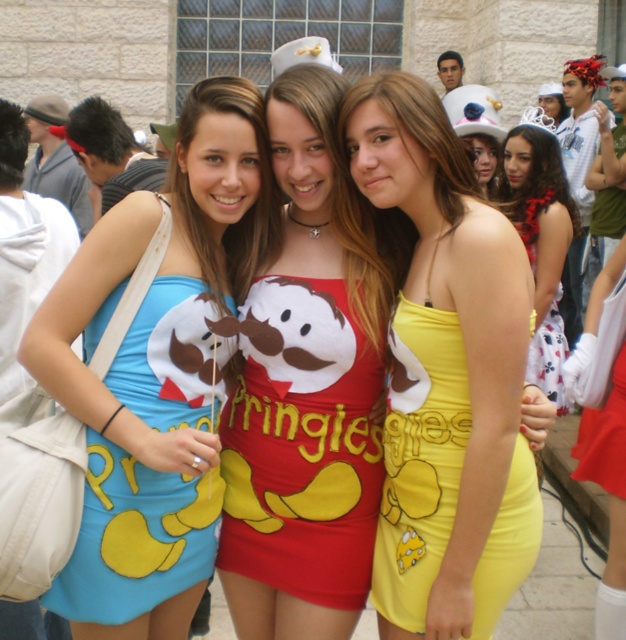
Does yellow satin dress at center lie behind white cotton glove at right?

No.

Is yellow satin dress at center to the right of white cotton glove at right from the viewer's perspective?

No, yellow satin dress at center is not to the right of white cotton glove at right.

Between point (423, 365) and point (612, 288), which one is positioned in front?

Point (423, 365)

This screenshot has width=626, height=640. What are the coordinates of `yellow satin dress at center` in the screenshot? It's located at (444, 376).

Does matte red dress at center appear under yellow satin dress at lower right?

Incorrect, matte red dress at center is not positioned below yellow satin dress at lower right.

Does point (237, 593) lie behind point (590, 337)?

No, (237, 593) is closer to viewer.

In order to click on matte red dress at center in this screenshot , I will do `click(305, 388)`.

Does point (565, 365) lie behind point (528, 248)?

No, (565, 365) is closer to viewer.

Which is in front, point (577, 465) or point (535, 376)?

Positioned in front is point (535, 376).

Where is `white cotton glove at right`? This screenshot has height=640, width=626. white cotton glove at right is located at coordinates (608, 488).